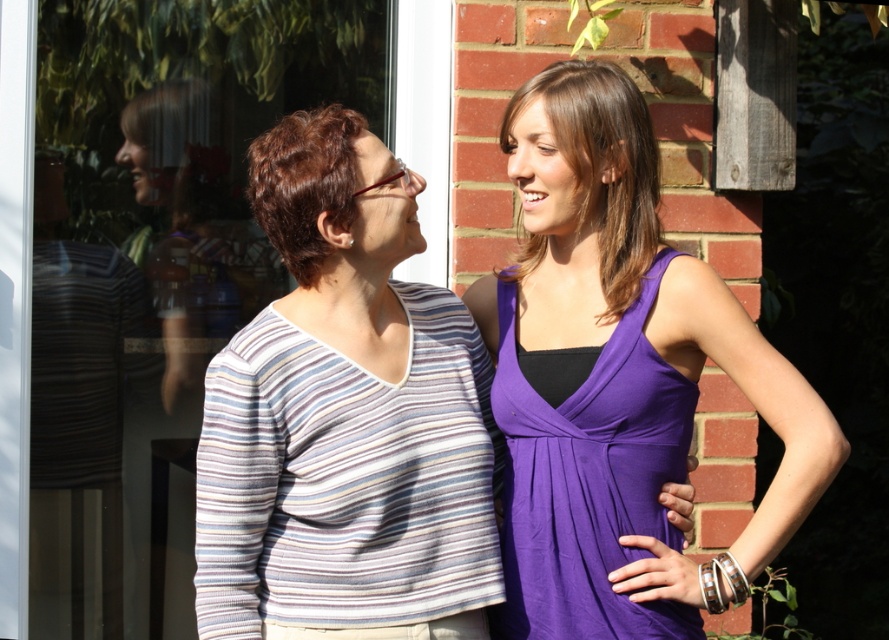
Question: Does purple fabric dress at right appear on the left side of purple satin dress at upper right?

Choices:
 (A) yes
 (B) no

Answer: (B)

Question: Which point appears farthest from the camera in this image?

Choices:
 (A) (533, 518)
 (B) (380, 502)
 (C) (603, 164)
 (D) (511, 346)

Answer: (D)

Question: Considering the real-world distances, which object is farthest from the purple satin dress at right?

Choices:
 (A) dark brown hair at center
 (B) striped fabric shirt at center

Answer: (A)

Question: Does striped fabric shirt at center have a larger size compared to purple fabric dress at right?

Choices:
 (A) no
 (B) yes

Answer: (A)

Question: Considering the real-world distances, which object is farthest from the dark brown hair at center?

Choices:
 (A) purple satin dress at right
 (B) purple satin dress at upper right

Answer: (A)

Question: Considering the relative positions of purple fabric dress at right and purple satin dress at upper right in the image provided, where is purple fabric dress at right located with respect to purple satin dress at upper right?

Choices:
 (A) left
 (B) right

Answer: (B)